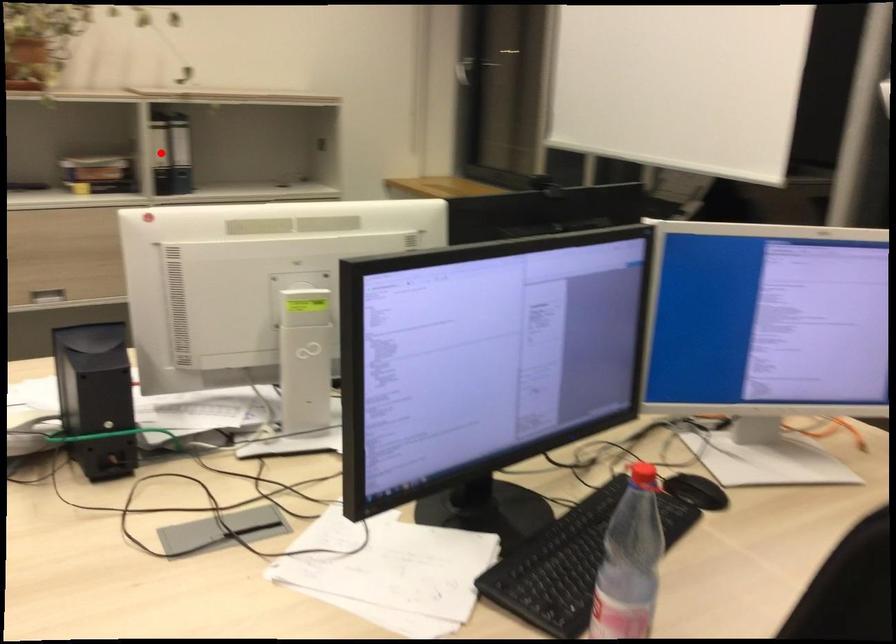
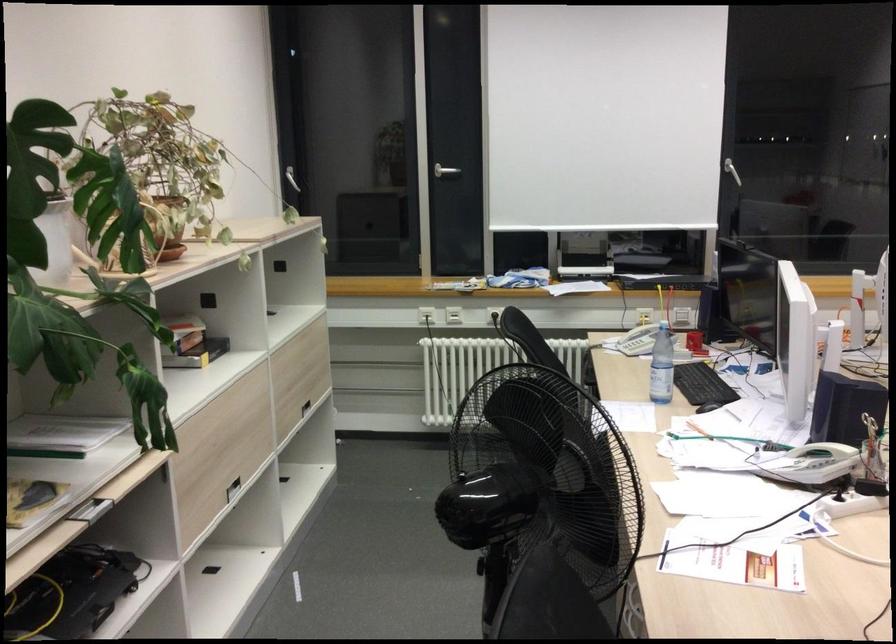
Question: I am providing you with two images of the same scene from different viewpoints. A red point is marked on the first image. Is the red point's position out of view in image 2?

Choices:
 (A) Yes
 (B) No

Answer: (A)